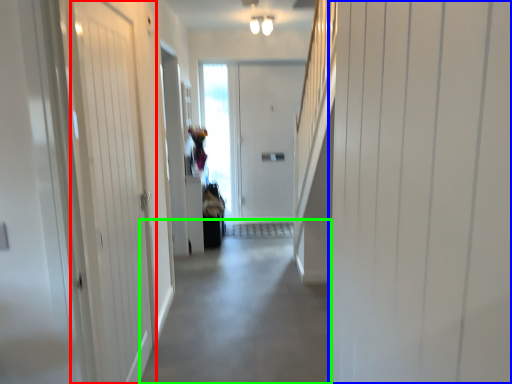
Question: Which object is positioned closest to door (highlighted by a red box)? Select from door (highlighted by a blue box) and alley (highlighted by a green box).

Choices:
 (A) door
 (B) alley

Answer: (B)